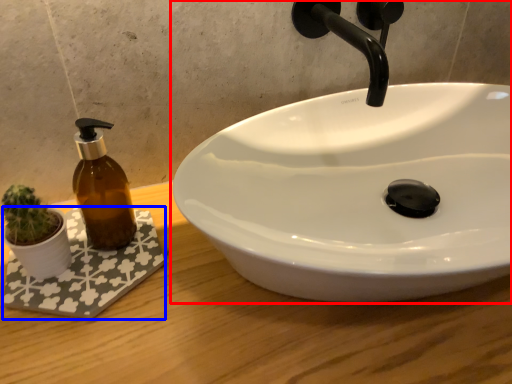
Question: Among these objects, which one is farthest to the camera, sink (highlighted by a red box) or bath mat (highlighted by a blue box)?

Choices:
 (A) sink
 (B) bath mat

Answer: (B)